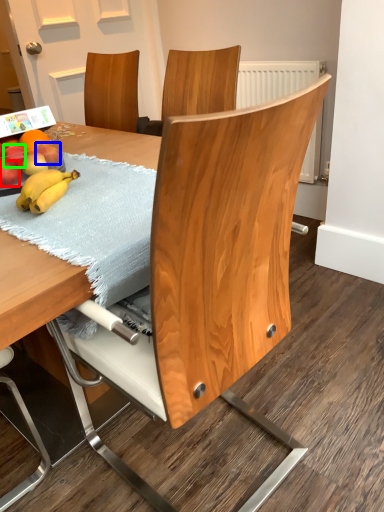
Question: Which is farther away from apple (highlighted by a red box)? apple (highlighted by a blue box) or apple (highlighted by a green box)?

Choices:
 (A) apple
 (B) apple

Answer: (A)